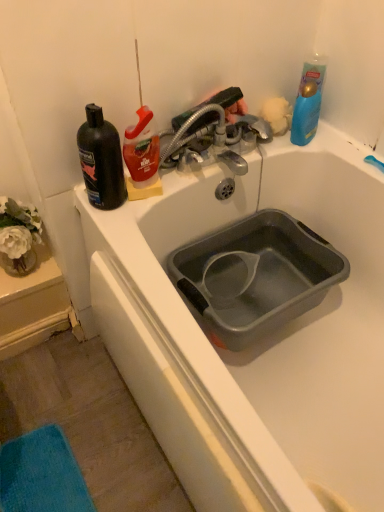
Question: Is metallic silver faucet at upper center to the left or to the right of gray plastic basin at center in the image?

Choices:
 (A) left
 (B) right

Answer: (A)

Question: From a real-world perspective, is metallic silver faucet at upper center above or below gray plastic basin at center?

Choices:
 (A) below
 (B) above

Answer: (B)

Question: Which is nearer to the metallic silver faucet at upper center?

Choices:
 (A) blue glossy bottle at upper right
 (B) fluffy yellow sponge at upper right
 (C) black matte bottle at left
 (D) gray plastic basin at center

Answer: (B)

Question: Which is nearer to the metallic silver faucet at upper center?

Choices:
 (A) gray plastic basin at center
 (B) blue glossy bottle at upper right
 (C) fluffy yellow sponge at upper right
 (D) black matte bottle at left

Answer: (C)